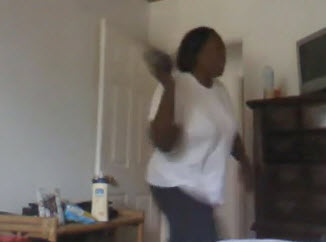
Find the location of `chair`. chair is located at coordinates (38, 223).